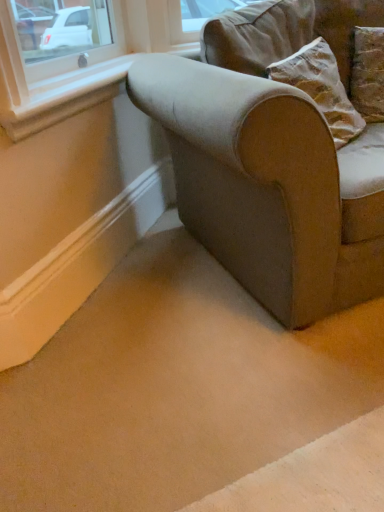
At what (x,y) coordinates should I click in order to perform the action: click on free point above white smooth window sill at upper left (from a real-world perspective). Please return your answer as a coordinate pair (x, y). This screenshot has height=512, width=384. Looking at the image, I should click on (83, 76).